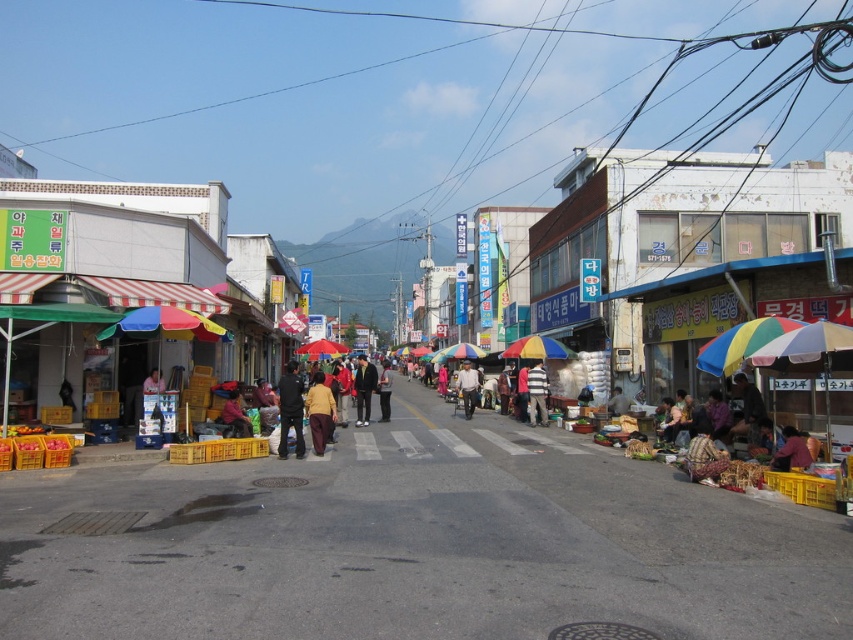
You are standing at the bustling street market and want to determine the relative positions of two points in the scene. Which point, point (532,378) or point (456,355), is closer to you?

Point (532,378) is closer to the viewer than point (456,355).

You are a tourist standing at the entrance of the market and want to take a photo that includes both the point at coordinates point [322,374] and point [355,424]. Since you want to ensure both points are in the frame, which point should you focus on first to make sure the other is also captured?

Point [322,374] is in front of point [355,424], so you should focus on point [322,374] first to ensure both are in the frame.